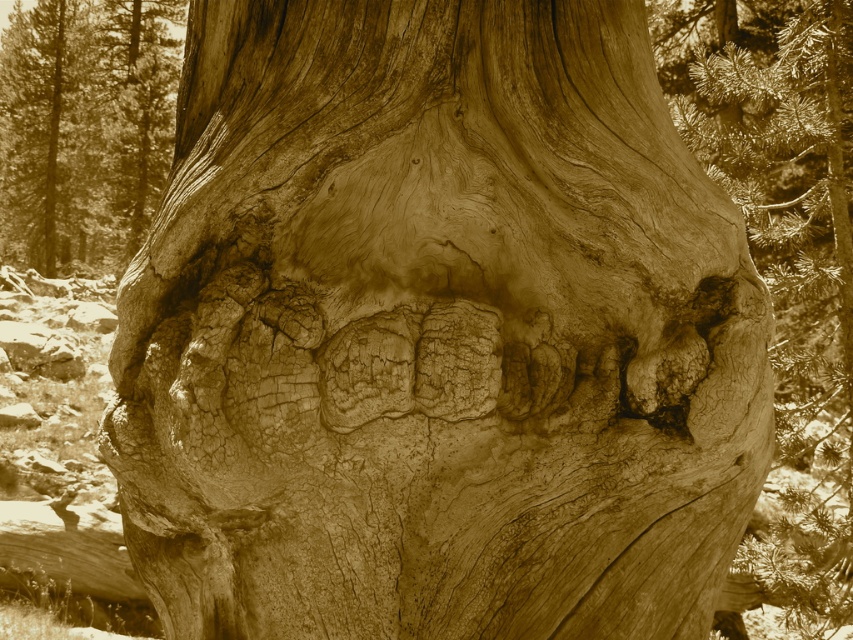
You are an artist trying to sketch the tree trunk in the image. You notice two areas labeled as rough bark tree trunk at center and rough textured bark at center. Which area should you focus on first if you want to start from the lower part of the tree?

The rough bark tree trunk at center is below rough textured bark at center, so you should focus on the rough bark tree trunk at center first since it is located lower on the tree.

You are an artist studying textures. You have two subjects in front of you, the rough bark tree trunk at center and the rough textured bark at center. Which one is taller?

The rough bark tree trunk at center is taller than the rough textured bark at center.

You are examining the intricate bark of the large tree trunk. There are two points marked on the bark at coordinates point (838, 61) and point (33, 250). Which of these points is nearer to your eyes as you look at the tree?

Point (838, 61) is closer to the viewer than point (33, 250).